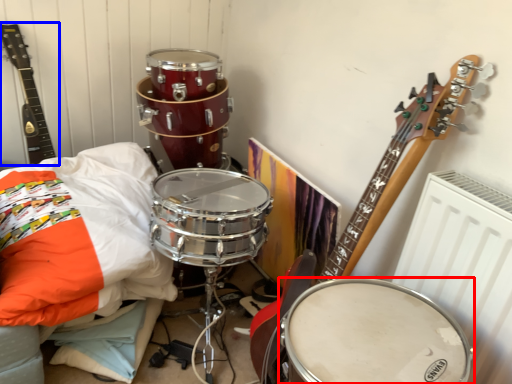
Question: Among these objects, which one is nearest to the camera, drum (highlighted by a red box) or guitar (highlighted by a blue box)?

Choices:
 (A) drum
 (B) guitar

Answer: (A)